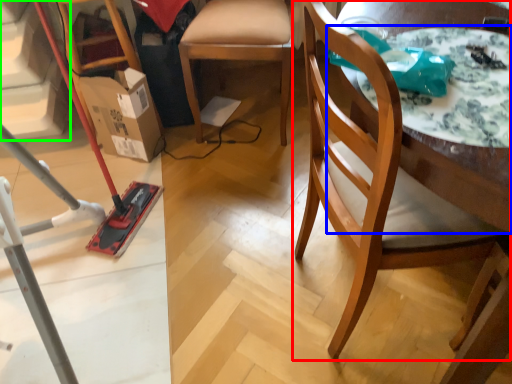
Question: Estimate the real-world distances between objects in this image. Which object is closer to chair (highlighted by a red box), round table (highlighted by a blue box) or stairwell (highlighted by a green box)?

Choices:
 (A) round table
 (B) stairwell

Answer: (A)